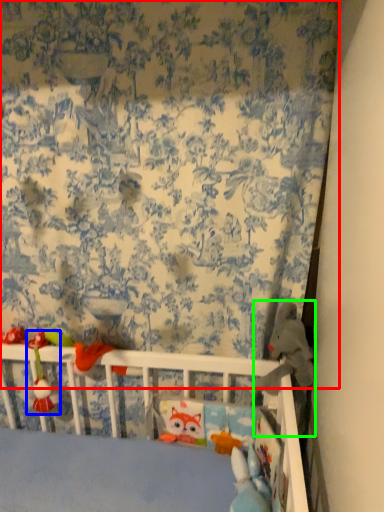
Question: Considering the real-world distances, which object is closest to curtain (highlighted by a red box)? toy (highlighted by a blue box) or toy (highlighted by a green box).

Choices:
 (A) toy
 (B) toy

Answer: (B)